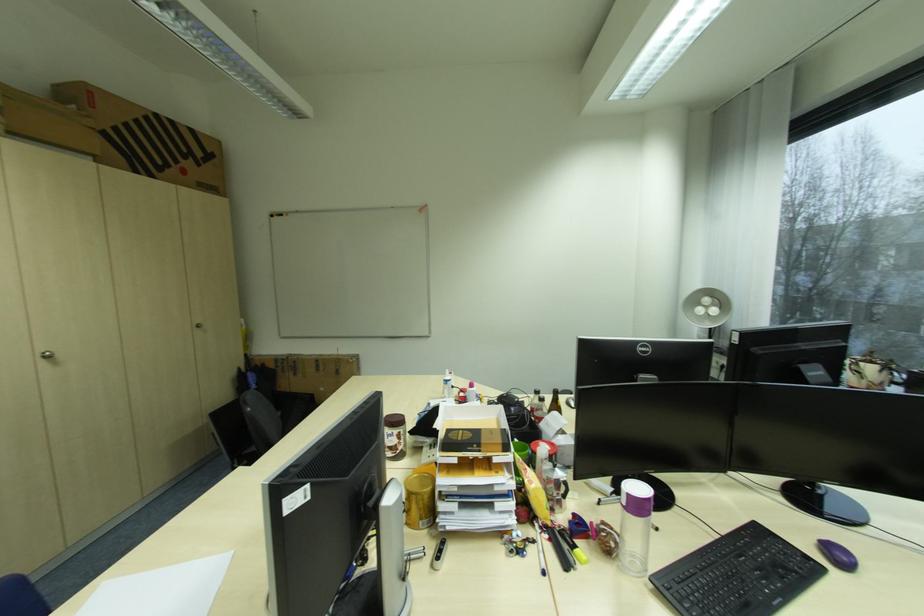
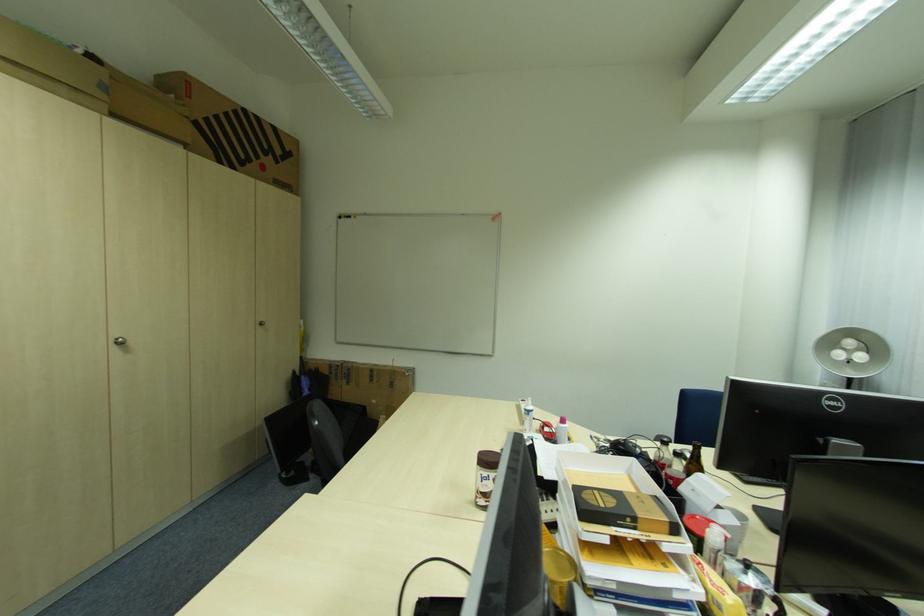
Question: The first image is from the beginning of the video and the second image is from the end. How did the camera likely rotate when shooting the video?

Choices:
 (A) Left
 (B) Right
 (C) Up
 (D) Down

Answer: (A)